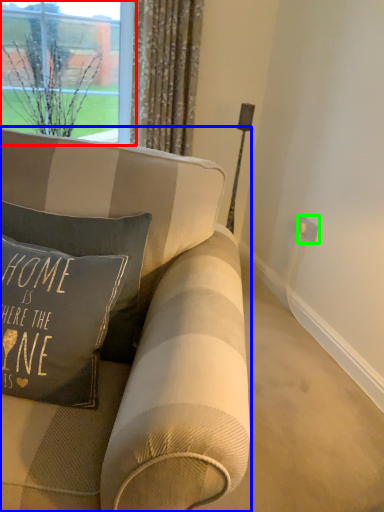
Question: Estimate the real-world distances between objects in this image. Which object is closer to window (highlighted by a red box), studio couch (highlighted by a blue box) or electric outlet (highlighted by a green box)?

Choices:
 (A) studio couch
 (B) electric outlet

Answer: (A)